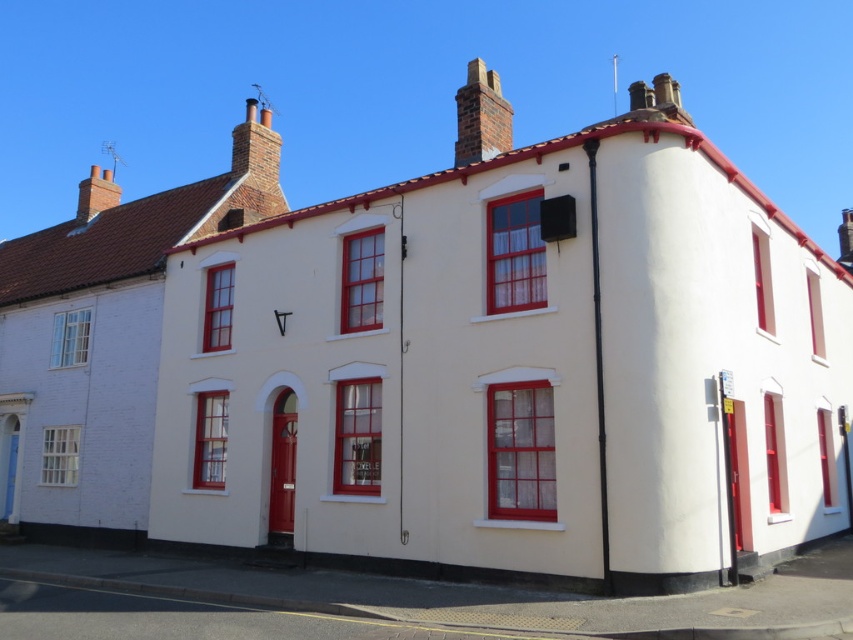
Question: In this image, where is white painted wood trim at center located relative to brick chimney at upper center?

Choices:
 (A) left
 (B) right

Answer: (B)

Question: Is white painted wood trim at center bigger than brick chimney at upper center?

Choices:
 (A) no
 (B) yes

Answer: (B)

Question: Can you confirm if white painted wood trim at center is positioned below brick chimney at upper center?

Choices:
 (A) no
 (B) yes

Answer: (B)